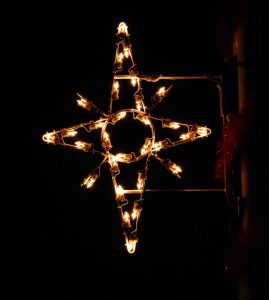
Locate an element on the screen. white bulb is located at coordinates (204, 133).